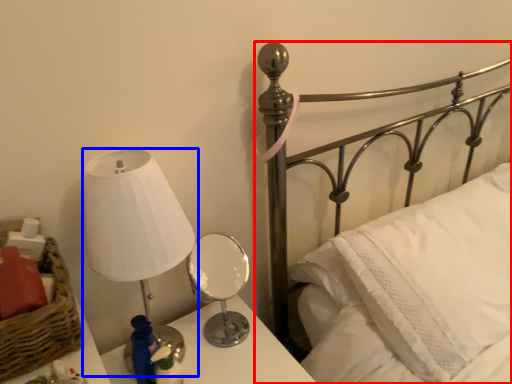
Question: Which point is closer to the camera, bed (highlighted by a red box) or lamp (highlighted by a blue box)?

Choices:
 (A) bed
 (B) lamp

Answer: (A)